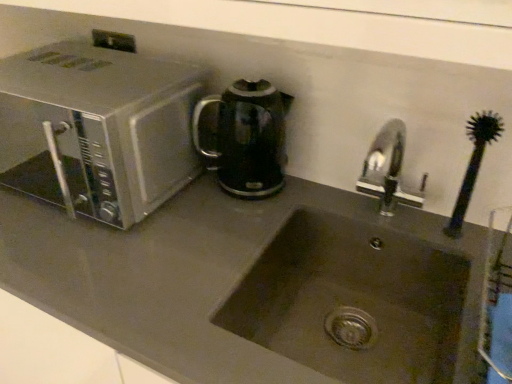
The width and height of the screenshot is (512, 384). In order to click on vacant space underneath silver metallic microwave at left (from a real-world perspective) in this screenshot , I will do `click(61, 185)`.